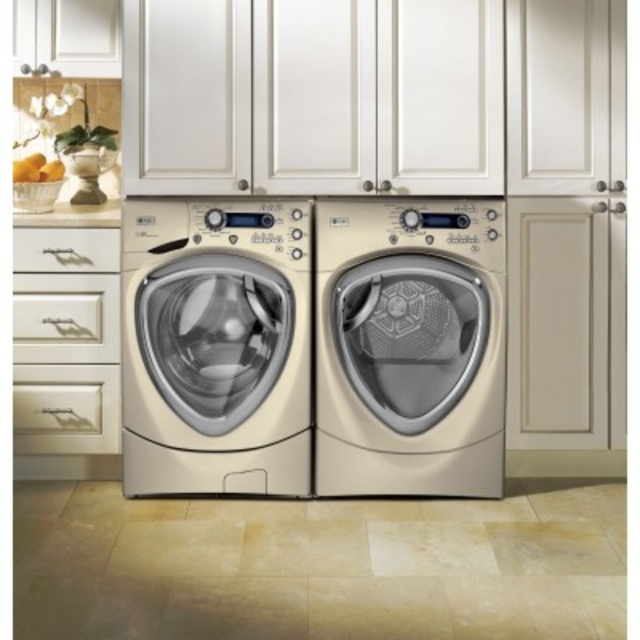
Question: Can you confirm if matte beige washing machine at center is thinner than cream matte washing machine at center?

Choices:
 (A) no
 (B) yes

Answer: (A)

Question: Which of the following is the closest to the observer?

Choices:
 (A) cream matte washing machine at center
 (B) matte beige washing machine at center

Answer: (A)

Question: Can you confirm if matte beige washing machine at center is positioned to the left of cream matte washing machine at center?

Choices:
 (A) no
 (B) yes

Answer: (A)

Question: Does matte beige washing machine at center appear on the left side of cream matte washing machine at center?

Choices:
 (A) no
 (B) yes

Answer: (A)

Question: Which point is farther from the camera taking this photo?

Choices:
 (A) (451, 288)
 (B) (282, 428)

Answer: (B)